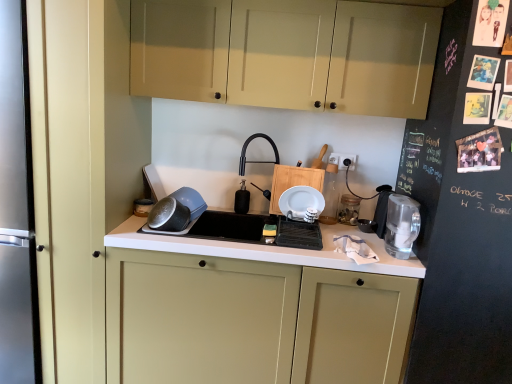
The width and height of the screenshot is (512, 384). In order to click on free spot to the left of clear glass water filter at right in this screenshot , I will do `click(366, 253)`.